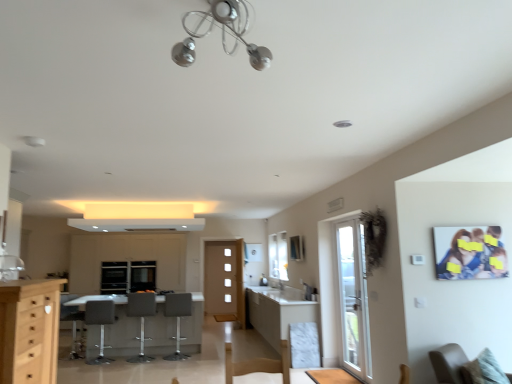
Question: From the image's perspective, is matte white cabinetry at center, positioned as the third cabinetry in right-to-left order, over white glossy exhaust hood at upper center?

Choices:
 (A) yes
 (B) no

Answer: (B)

Question: Is matte white cabinetry at center, positioned as the third cabinetry in right-to-left order, bigger than white glossy exhaust hood at upper center?

Choices:
 (A) yes
 (B) no

Answer: (A)

Question: Does matte white cabinetry at center, positioned as the third cabinetry in right-to-left order, touch white glossy exhaust hood at upper center?

Choices:
 (A) no
 (B) yes

Answer: (A)

Question: From a real-world perspective, is matte white cabinetry at center, the 1th cabinetry from the left, physically below white glossy exhaust hood at upper center?

Choices:
 (A) yes
 (B) no

Answer: (A)

Question: Does matte white cabinetry at center, which ranks as the third cabinetry in front-to-back order, appear on the right side of white glossy exhaust hood at upper center?

Choices:
 (A) no
 (B) yes

Answer: (A)

Question: Can you confirm if matte white cabinetry at center, positioned as the third cabinetry in right-to-left order, is taller than white glossy exhaust hood at upper center?

Choices:
 (A) no
 (B) yes

Answer: (B)

Question: Does black glass window screen at center appear on the left side of white marble cabinet at center, acting as the 1th cabinetry starting from the right?

Choices:
 (A) yes
 (B) no

Answer: (A)

Question: Is black glass window screen at center next to white marble cabinet at center, the 3th cabinetry viewed from the left, and touching it?

Choices:
 (A) yes
 (B) no

Answer: (B)

Question: From a real-world perspective, is black glass window screen at center positioned under white marble cabinet at center, marked as the 2th cabinetry in a front-to-back arrangement, based on gravity?

Choices:
 (A) yes
 (B) no

Answer: (B)

Question: Can white marble cabinet at center, the 3th cabinetry viewed from the left, be found inside black glass window screen at center?

Choices:
 (A) no
 (B) yes

Answer: (A)

Question: Is the depth of black glass window screen at center less than that of white marble cabinet at center, acting as the 1th cabinetry starting from the right?

Choices:
 (A) yes
 (B) no

Answer: (B)

Question: Is black glass window screen at center oriented towards white marble cabinet at center, marked as the 2th cabinetry in a front-to-back arrangement?

Choices:
 (A) no
 (B) yes

Answer: (A)

Question: Is matte gray bar stool at center, acting as the fourth armchair starting from the left, a part of light wood cabinet at left, the 1th cabinetry viewed from the front?

Choices:
 (A) no
 (B) yes

Answer: (A)